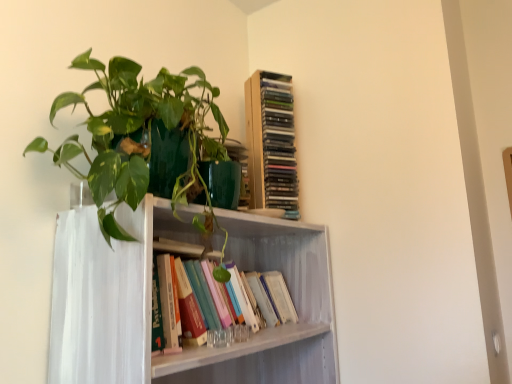
Question: Does green glossy plant at upper left lie behind wooden cd tower at upper center, the second book ordered from the bottom?

Choices:
 (A) yes
 (B) no

Answer: (B)

Question: Can you confirm if green glossy plant at upper left is positioned to the left of wooden cd tower at upper center, the first book in the top-to-bottom sequence?

Choices:
 (A) no
 (B) yes

Answer: (B)

Question: Are green glossy plant at upper left and wooden cd tower at upper center, the first book in the top-to-bottom sequence, far apart?

Choices:
 (A) yes
 (B) no

Answer: (B)

Question: Is green glossy plant at upper left at the right side of wooden cd tower at upper center, the first book in the top-to-bottom sequence?

Choices:
 (A) no
 (B) yes

Answer: (A)

Question: Does green glossy plant at upper left have a larger size compared to wooden cd tower at upper center, the first book in the top-to-bottom sequence?

Choices:
 (A) yes
 (B) no

Answer: (A)

Question: Does point (194, 74) appear closer or farther from the camera than point (218, 327)?

Choices:
 (A) closer
 (B) farther

Answer: (A)

Question: Is green glossy plant at upper left taller or shorter than hardcover books at center, which is the first book from bottom to top?

Choices:
 (A) short
 (B) tall

Answer: (B)

Question: In the image, is green glossy plant at upper left positioned in front of or behind hardcover books at center, which is the first book from bottom to top?

Choices:
 (A) front
 (B) behind

Answer: (A)

Question: From the image's perspective, is green glossy plant at upper left located above or below hardcover books at center, which is the first book from bottom to top?

Choices:
 (A) below
 (B) above

Answer: (B)

Question: From the image's perspective, is hardcover books at center, which is the first book from bottom to top, above or below green glossy plant at upper left?

Choices:
 (A) above
 (B) below

Answer: (B)

Question: In terms of size, does hardcover books at center, which is the first book from bottom to top, appear bigger or smaller than green glossy plant at upper left?

Choices:
 (A) big
 (B) small

Answer: (B)

Question: Visually, is hardcover books at center, the 2th book in the top-to-bottom sequence, positioned to the left or to the right of green glossy plant at upper left?

Choices:
 (A) right
 (B) left

Answer: (A)

Question: In the image, is hardcover books at center, which is the first book from bottom to top, positioned in front of or behind green glossy plant at upper left?

Choices:
 (A) behind
 (B) front

Answer: (A)

Question: In the image, is wooden cd tower at upper center, the second book ordered from the bottom, positioned in front of or behind hardcover books at center, which is the first book from bottom to top?

Choices:
 (A) front
 (B) behind

Answer: (B)

Question: In terms of height, does wooden cd tower at upper center, the second book ordered from the bottom, look taller or shorter compared to hardcover books at center, which is the first book from bottom to top?

Choices:
 (A) short
 (B) tall

Answer: (B)